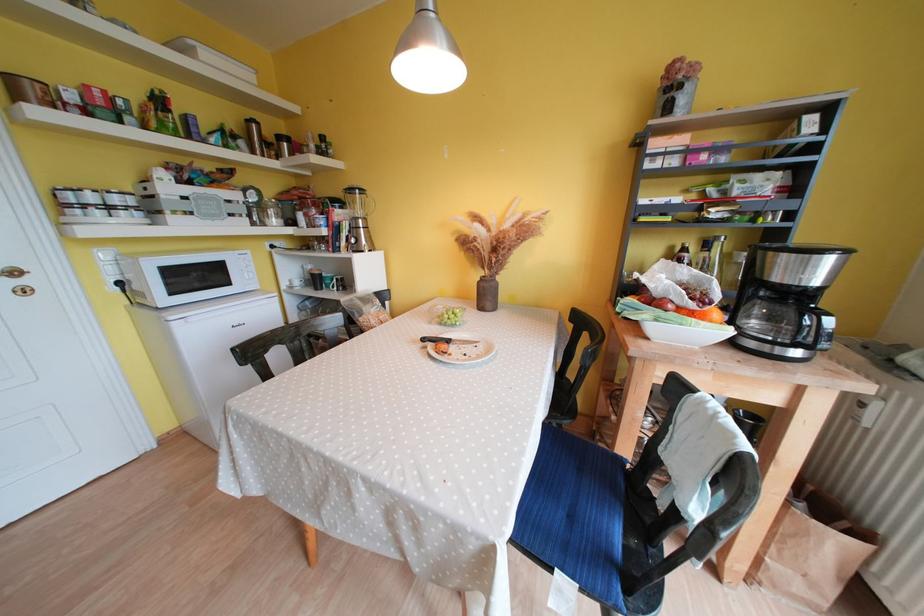
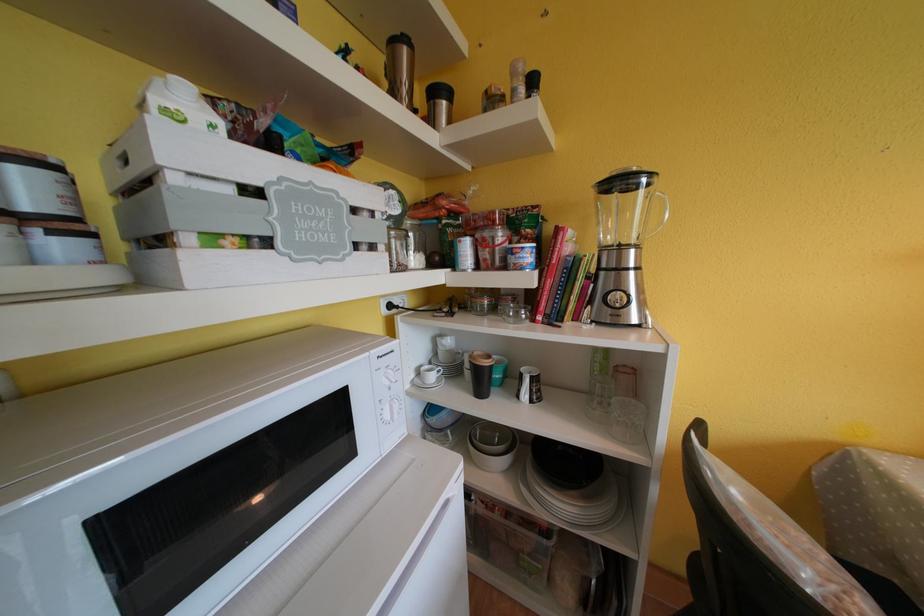
Find the pixel in the second image that matches pixel 278 249 in the first image.

(396, 310)